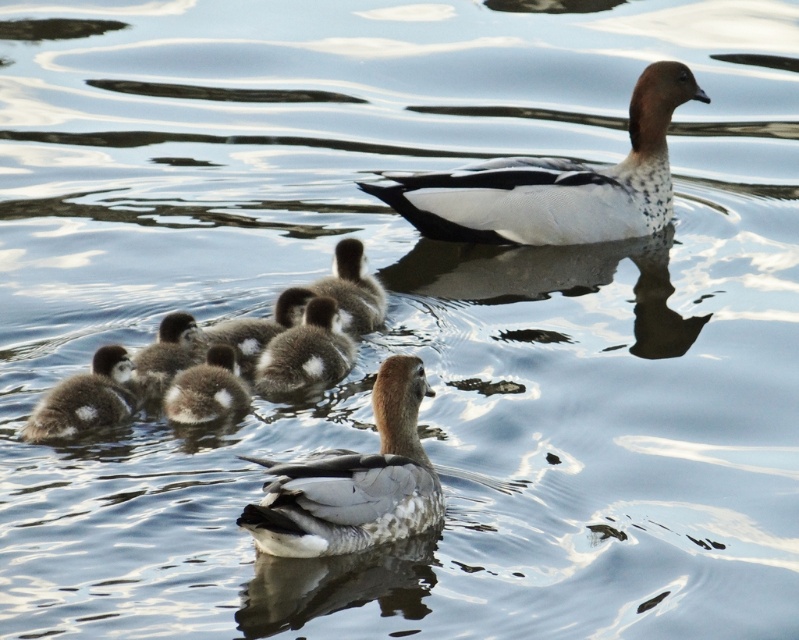
You are standing at the edge of the pond and want to throw a duck food pellet to the closest point between point (356, 312) and point (169, 328). Which point should you aim for?

Point (356, 312) is closer to you than point (169, 328), so you should aim for point (356, 312) to reach the closest point.

Looking at this image, you are a photographer trying to capture the perfect shot of the brown downy duckling at center. Based on its position, can you determine if it is closer to the front or the back of the image?

The brown downy duckling at center is located at point (352, 289), which places it near the center of the image. Since it is at the center, it is neither closer to the front nor the back but positioned midway between them.